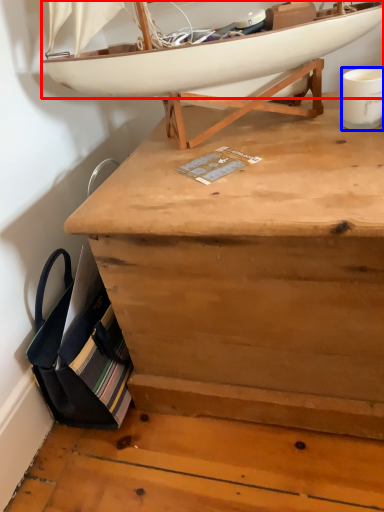
Question: Which object appears closest to the camera in this image, boat (highlighted by a red box) or coffee cup (highlighted by a blue box)?

Choices:
 (A) boat
 (B) coffee cup

Answer: (A)